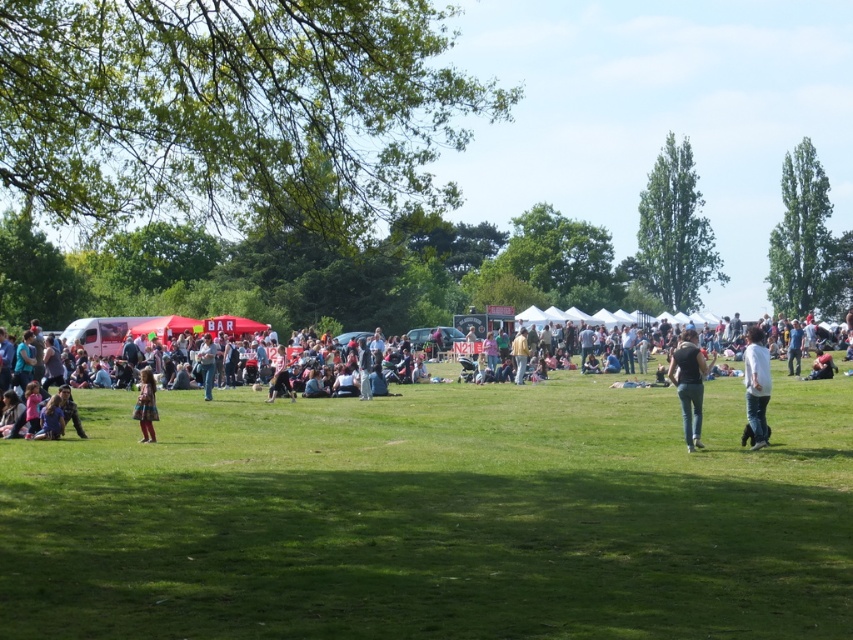
You are a photographer aiming to capture a photo of both the dark gray jeans at center and the plaid fabric dress at lower left without any obstruction. Based on the scene, which object should you focus on first to ensure both are in frame?

You should focus on the dark gray jeans at center first because it is located above the plaid fabric dress at lower left, so positioning the camera to include the upper area where the jeans are will naturally include the lower area where the dress is positioned.

You are organizing a game that requires participants to stand exactly 8 meters apart. You spot two people wearing jeans at center and a person in a white cotton shirt at right. Can these two individuals participate in the game together?

The jeans at center and white cotton shirt at right are 7.84 meters apart, which is less than 8 meters. Therefore, they cannot participate in the game together as they are too close to each other.